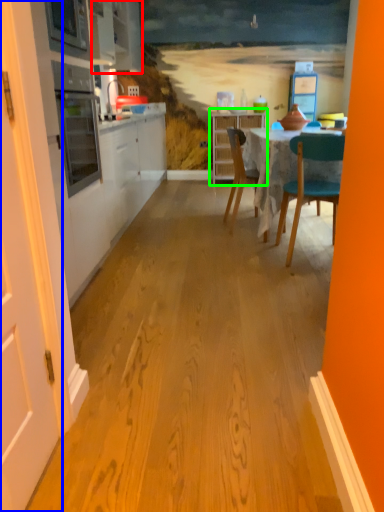
Question: Which object is the closest to the cabinetry (highlighted by a red box)? Choose among these: door (highlighted by a blue box) or cabinetry (highlighted by a green box).

Choices:
 (A) door
 (B) cabinetry

Answer: (B)